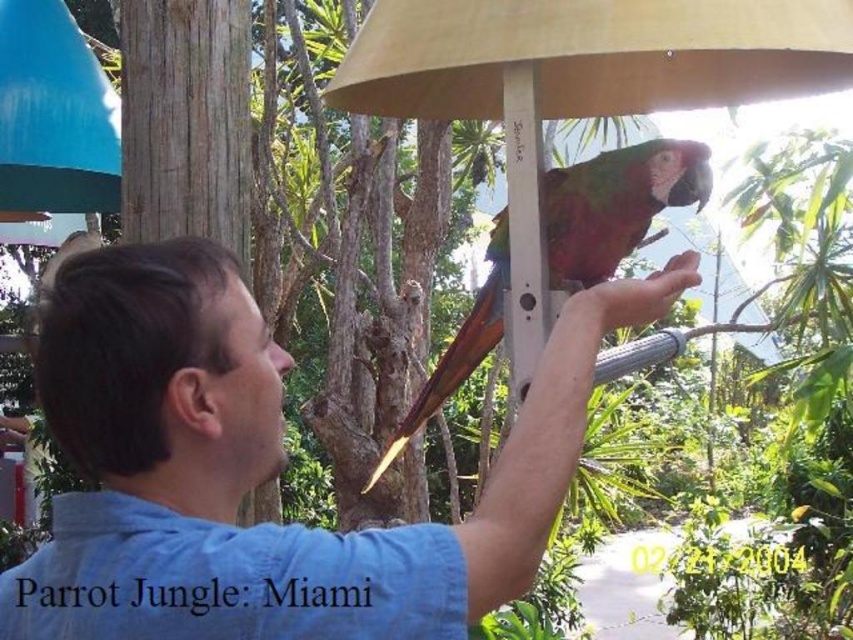
Can you confirm if blue cotton shirt at center is positioned to the right of green matte parrot at center?

Indeed, blue cotton shirt at center is positioned on the right side of green matte parrot at center.

Between blue cotton shirt at center and green matte parrot at center, which one appears on the left side from the viewer's perspective?

green matte parrot at center is more to the left.

Does point (65, 532) come farther from viewer compared to point (703, 166)?

No, it is in front of (703, 166).

You are a GUI agent. You are given a task and a screenshot of the screen. Output one action in this format:
    pyautogui.click(x=<x>, y=<y>)
    Task: Click on the blue cotton shirt at center
    
    Given the screenshot: What is the action you would take?
    pyautogui.click(x=263, y=468)